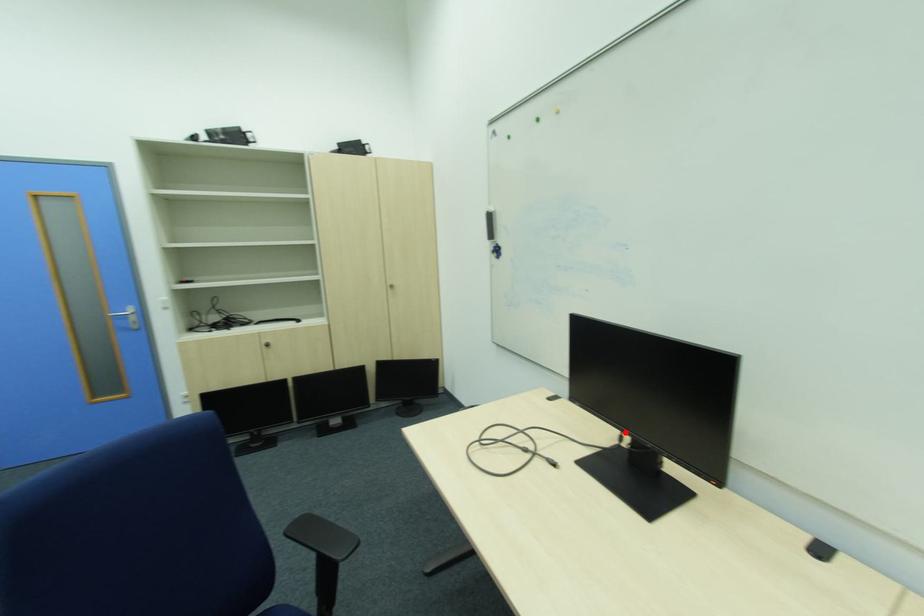
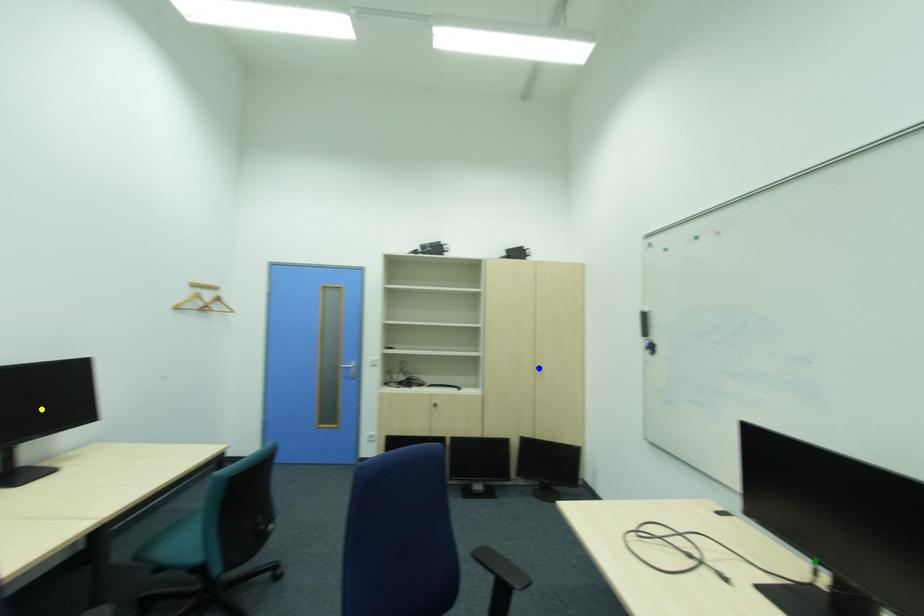
Question: I am providing you with two images of the same scene from different viewpoints. A red point is marked on the first image. You are given multiple points on the second image. Which spot in image 2 lines up with the point in image 1?

Choices:
 (A) green point
 (B) yellow point
 (C) blue point

Answer: (A)